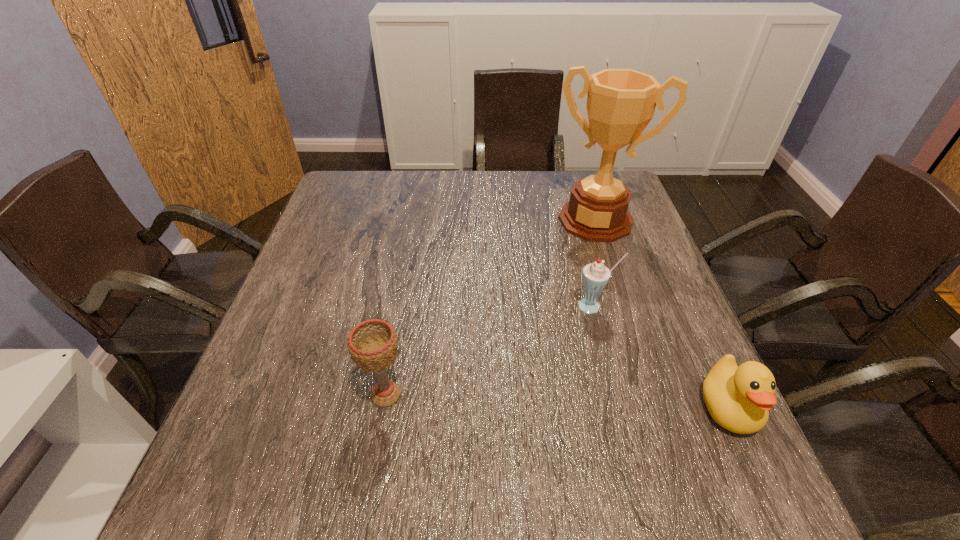
Find the location of `blank area located on the front-facing side of the award`. blank area located on the front-facing side of the award is located at coordinates (563, 291).

This screenshot has width=960, height=540. I want to click on free space located 0.350m on the front-facing side of the award, so click(545, 332).

You are a GUI agent. You are given a task and a screenshot of the screen. Output one action in this format:
    pyautogui.click(x=<x>, y=<y>)
    Task: Click on the object situated at the far edge
    The height and width of the screenshot is (540, 960).
    Given the screenshot: What is the action you would take?
    pyautogui.click(x=621, y=102)

I want to click on chalice located at the near edge, so click(x=372, y=344).

Identify the location of duck that is at the near edge. (738, 398).

You are a GUI agent. You are given a task and a screenshot of the screen. Output one action in this format:
    pyautogui.click(x=<x>, y=<y>)
    Task: Click on the duck that is at the right edge
    The width and height of the screenshot is (960, 540).
    Given the screenshot: What is the action you would take?
    pyautogui.click(x=738, y=398)

This screenshot has width=960, height=540. Find the location of `milkshake present at the right edge`. milkshake present at the right edge is located at coordinates (595, 276).

Locate an element on the screen. award that is at the right edge is located at coordinates (621, 102).

Find the location of a particular element. The image size is (960, 540). object that is at the far right corner is located at coordinates (621, 102).

Image resolution: width=960 pixels, height=540 pixels. I want to click on object present at the near right corner, so click(738, 398).